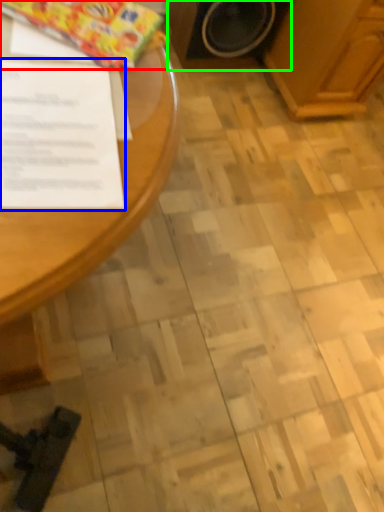
Question: Based on their relative distances, which object is farther from wrapping paper (highlighted by a red box)? Choose from document (highlighted by a blue box) and appliance (highlighted by a green box).

Choices:
 (A) document
 (B) appliance

Answer: (B)